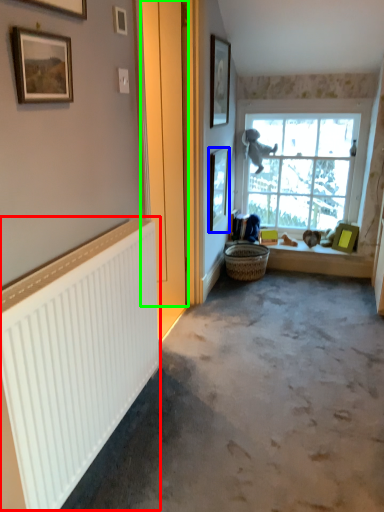
Question: Which object is positioned farthest from radiator (highlighted by a red box)? Select from picture frame (highlighted by a blue box) and door (highlighted by a green box).

Choices:
 (A) picture frame
 (B) door

Answer: (A)